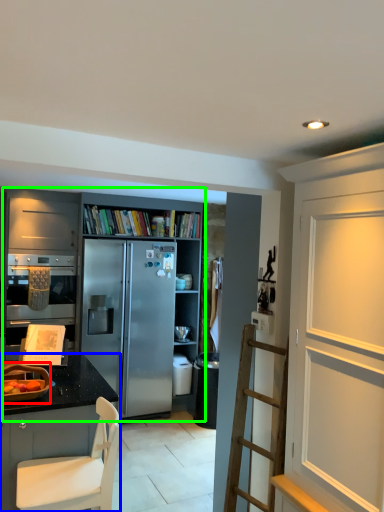
Question: Estimate the real-world distances between objects in this image. Which object is closer to appliance (highlighted by a red box), cabinetry (highlighted by a blue box) or cabinetry (highlighted by a green box)?

Choices:
 (A) cabinetry
 (B) cabinetry

Answer: (A)